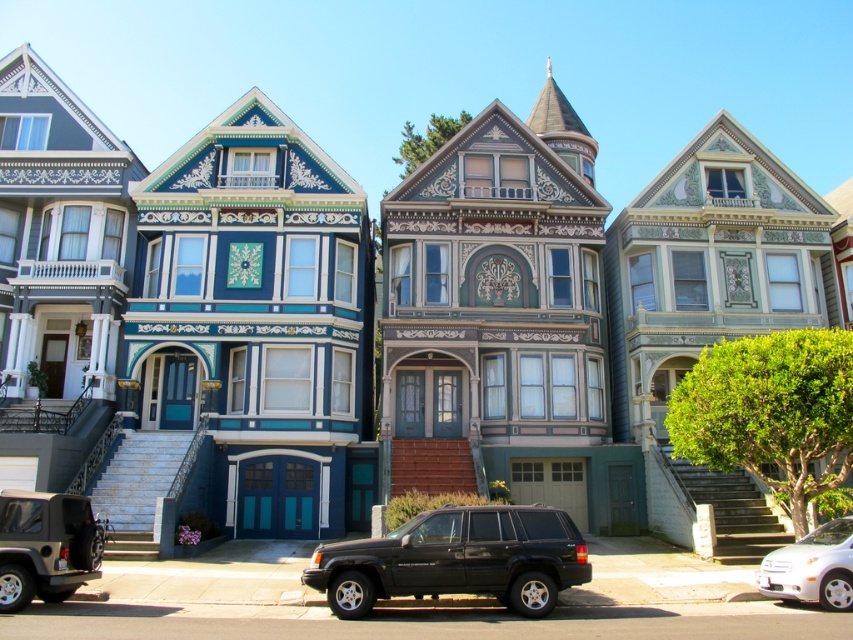
Can you confirm if matte black suv at center is wider than matte black suv at lower left?

Correct, the width of matte black suv at center exceeds that of matte black suv at lower left.

Between point (526, 524) and point (86, 520), which one is positioned in front?

Positioned in front is point (526, 524).

Where is `matte black suv at center`? The image size is (853, 640). matte black suv at center is located at coordinates (456, 560).

The height and width of the screenshot is (640, 853). What are the coordinates of `matte black suv at lower left` in the screenshot? It's located at point(45,547).

Which is in front, point (21, 506) or point (778, 552)?

Positioned in front is point (21, 506).

Does point (24, 582) come closer to viewer compared to point (825, 532)?

Yes, point (24, 582) is in front of point (825, 532).

I want to click on matte black suv at lower left, so click(x=45, y=547).

Between matte black suv at center and white glossy sedan at lower right, which one is positioned lower?

Positioned lower is white glossy sedan at lower right.

Does matte black suv at center appear under white glossy sedan at lower right?

No.

Identify the location of matte black suv at center. (456, 560).